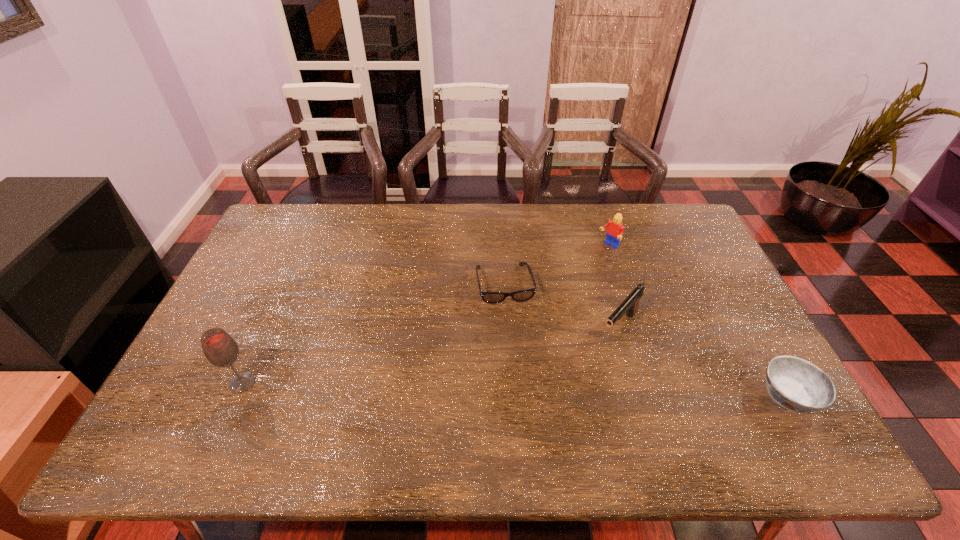
I want to click on the tallest object, so click(x=220, y=349).

Find the location of `the leftmost object`. the leftmost object is located at coordinates (220, 349).

Where is `the rightmost object`? This screenshot has width=960, height=540. the rightmost object is located at coordinates (794, 383).

Identify the location of spectacles. This screenshot has height=540, width=960. (523, 295).

This screenshot has width=960, height=540. In order to click on the farthest object in this screenshot , I will do 614,232.

Where is `pistol`? pistol is located at coordinates (630, 305).

This screenshot has height=540, width=960. In order to click on free location located 0.080m on the left of the leftmost object in this screenshot , I will do `click(198, 383)`.

You are a GUI agent. You are given a task and a screenshot of the screen. Output one action in this format:
    pyautogui.click(x=<x>, y=<y>)
    Task: Click on the vacant area situated on the back of the rightmost object
    This screenshot has height=540, width=960.
    Given the screenshot: What is the action you would take?
    pyautogui.click(x=717, y=269)

At what (x,y) coordinates should I click in order to perform the action: click on free region located on the lenses of the second object from left to right. Please return your answer as a coordinate pair (x, y). This screenshot has height=540, width=960. Looking at the image, I should click on (520, 364).

Find the location of a particular element. vacant space located on the lenses of the second object from left to right is located at coordinates (520, 364).